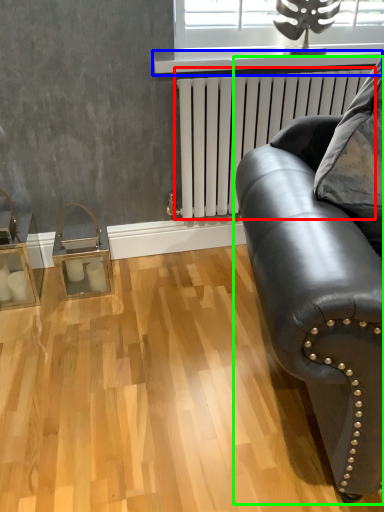
Question: Considering the real-world distances, which object is closest to radiator (highlighted by a red box)? window sill (highlighted by a blue box) or studio couch (highlighted by a green box).

Choices:
 (A) window sill
 (B) studio couch

Answer: (A)